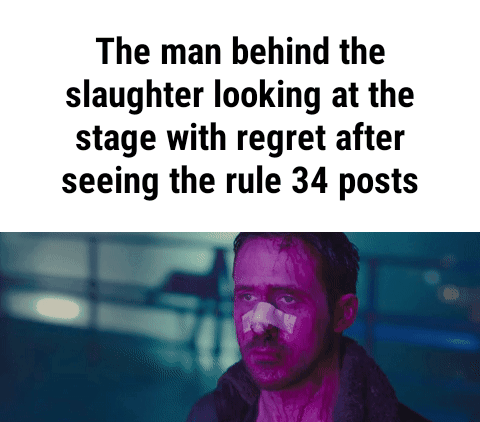
Where is `plaster`? Image resolution: width=480 pixels, height=422 pixels. plaster is located at coordinates (260, 309).